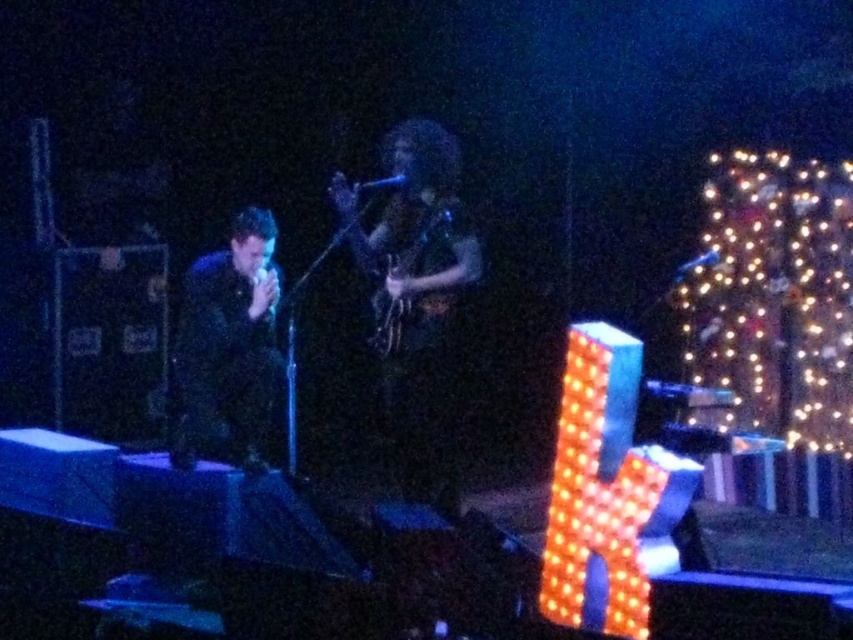
You are a stagehand who needs to place a new microphone stand between the shiny black guitar at center and the black matte suit at left. Based on the scene, can the stand fit between them if it requires 1 meter of space?

The shiny black guitar at center is wider than the black matte suit at left. However, the description only provides information about their widths, not the distance between them. Without knowing the actual distance, it is impossible to determine if the microphone stand will fit.

You are a stagehand preparing to adjust the lighting for the performance. You need to position a spotlight on the shiny black guitar at center and another on the black matte suit at left. Based on their positions, which object should you light first if you start from the left side of the stage and move towards the right?

The black matte suit at left should be lit first since it is positioned to the left of the shiny black guitar at center, so you would encounter it first when moving from left to right.

You are a photographer adjusting your camera settings to capture the stage performance. You notice two points of interest marked at coordinates point (x=425, y=412) and point (x=177, y=403). Which point is closer to your camera lens?

Point (x=425, y=412) is closer to the camera than point (x=177, y=403).